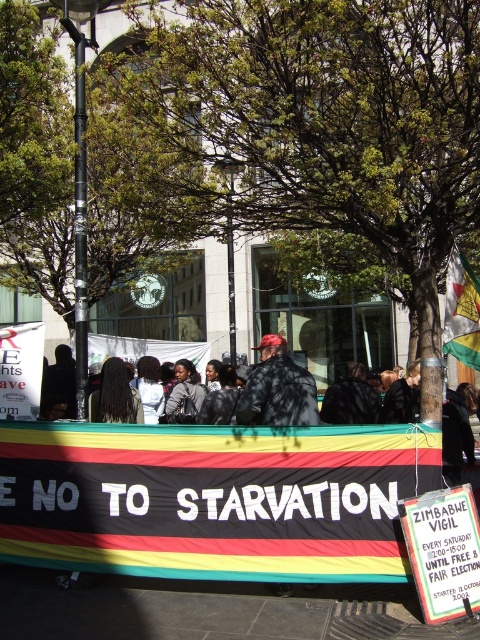
Question: Is black fabric banner at center below dark gray jacket at center?

Choices:
 (A) yes
 (B) no

Answer: (A)

Question: Estimate the real-world distances between objects in this image. Which object is closer to the black fabric banner at center?

Choices:
 (A) long black hair at center
 (B) yellow-green fabric flag at center-right

Answer: (A)

Question: Can you confirm if black fabric banner at center is positioned to the left of matte black jacket at center?

Choices:
 (A) yes
 (B) no

Answer: (A)

Question: Which object appears closest to the camera in this image?

Choices:
 (A) black fabric banner at center
 (B) dark gray jacket at center
 (C) yellow-green fabric flag at center-right
 (D) long black hair at center

Answer: (A)

Question: Which point is closer to the camera taking this photo?

Choices:
 (A) click(x=120, y=358)
 (B) click(x=368, y=388)

Answer: (B)

Question: Does matte black jacket at center have a smaller size compared to dark gray jacket at center?

Choices:
 (A) yes
 (B) no

Answer: (B)